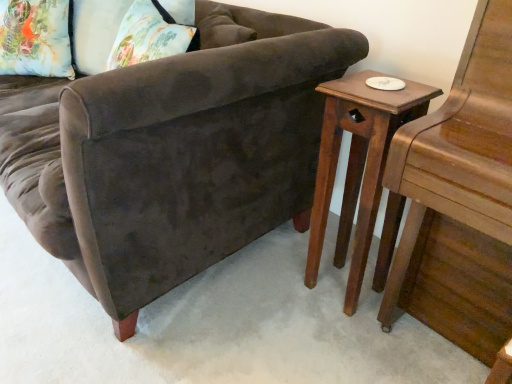
What is the approximate height of velvet brown couch at center?

34.74 inches.

This screenshot has width=512, height=384. What do you see at coordinates (357, 166) in the screenshot?
I see `wooden side table at right` at bounding box center [357, 166].

The image size is (512, 384). I want to click on velvet brown couch at center, so click(172, 153).

In the scene shown: Is wooden side table at right located outside velvet brown couch at center?

Yes, wooden side table at right is outside of velvet brown couch at center.

From a real-world perspective, is wooden side table at right on top of velvet brown couch at center?

No, from a real-world perspective, wooden side table at right is not above velvet brown couch at center.

How much distance is there between wooden side table at right and velvet brown couch at center?

wooden side table at right is 14.83 inches from velvet brown couch at center.

Considering the relative positions of wooden side table at right and velvet brown couch at center in the image provided, is wooden side table at right to the right of velvet brown couch at center from the viewer's perspective?

Correct, you'll find wooden side table at right to the right of velvet brown couch at center.

From the image's perspective, between wooden side table at right and floral fabric pillow at upper left, who is located below?

wooden side table at right is shown below in the image.

Between wooden side table at right and floral fabric pillow at upper left, which one appears on the right side from the viewer's perspective?

From the viewer's perspective, wooden side table at right appears more on the right side.

Is wooden side table at right in front of or behind floral fabric pillow at upper left in the image?

In the image, wooden side table at right appears in front of floral fabric pillow at upper left.

From a real-world perspective, is wooden side table at right beneath floral fabric pillow at upper left?

Yes, from a real-world perspective, wooden side table at right is beneath floral fabric pillow at upper left.

From the image's perspective, is floral fabric pillow at upper left below wooden side table at right?

Incorrect, from the image's perspective, floral fabric pillow at upper left is higher than wooden side table at right.

Considering the points (32, 15) and (350, 153), which point is behind, point (32, 15) or point (350, 153)?

Point (32, 15)

Locate an element on the screen. The image size is (512, 384). table that is on the right side of floral fabric pillow at upper left is located at coordinates (357, 166).

How different are the orientations of floral fabric pillow at upper left and wooden side table at right in degrees?

They differ by 31.9 degrees in their facing directions.

Would you say velvet brown couch at center is outside floral fabric pillow at upper left?

Yes, velvet brown couch at center is outside of floral fabric pillow at upper left.

How many degrees apart are the facing directions of velvet brown couch at center and floral fabric pillow at upper left?

The angle between the facing direction of velvet brown couch at center and the facing direction of floral fabric pillow at upper left is 34.5 degrees.

Consider the image. Looking at their sizes, would you say velvet brown couch at center is wider or thinner than floral fabric pillow at upper left?

Clearly, velvet brown couch at center has more width compared to floral fabric pillow at upper left.

Based on their sizes in the image, would you say velvet brown couch at center is bigger or smaller than floral fabric pillow at upper left?

velvet brown couch at center is bigger than floral fabric pillow at upper left.

Does point (77, 104) lie in front of point (314, 267)?

Yes, point (77, 104) is closer to viewer.

From the image's perspective, is velvet brown couch at center under wooden side table at right?

Incorrect, from the image's perspective, velvet brown couch at center is higher than wooden side table at right.

Which object is further away from the camera, velvet brown couch at center or wooden side table at right?

wooden side table at right is behind.

Between point (26, 23) and point (221, 67), which one is positioned in front?

The point (221, 67) is in front.

Is velvet brown couch at center inside floral fabric pillow at upper left?

No.

Which object is closer to the camera, floral fabric pillow at upper left or velvet brown couch at center?

velvet brown couch at center is in front.

Image resolution: width=512 pixels, height=384 pixels. I want to click on table that appears behind the velvet brown couch at center, so click(357, 166).

Where is `table that appears in front of the floral fabric pillow at upper left`? table that appears in front of the floral fabric pillow at upper left is located at coordinates (357, 166).

Looking at the image, which one is located closer to velvet brown couch at center, wooden side table at right or floral fabric pillow at upper left?

Based on the image, wooden side table at right appears to be nearer to velvet brown couch at center.

Consider the image. Which object lies nearer to the anchor point velvet brown couch at center, floral fabric pillow at upper left or wooden side table at right?

The object closer to velvet brown couch at center is wooden side table at right.

Looking at the image, which one is located closer to wooden side table at right, velvet brown couch at center or floral fabric pillow at upper left?

velvet brown couch at center.

When comparing their distances from floral fabric pillow at upper left, does wooden side table at right or velvet brown couch at center seem closer?

Among the two, velvet brown couch at center is located nearer to floral fabric pillow at upper left.

Estimate the real-world distances between objects in this image. Which object is closer to wooden side table at right, floral fabric pillow at upper left or velvet brown couch at center?

The object closer to wooden side table at right is velvet brown couch at center.

When comparing their distances from floral fabric pillow at upper left, does velvet brown couch at center or wooden side table at right seem closer?

velvet brown couch at center.

At what (x,y) coordinates should I click in order to perform the action: click on studio couch located between floral fabric pillow at upper left and wooden side table at right in the left-right direction. Please return your answer as a coordinate pair (x, y). This screenshot has height=384, width=512. Looking at the image, I should click on (172, 153).